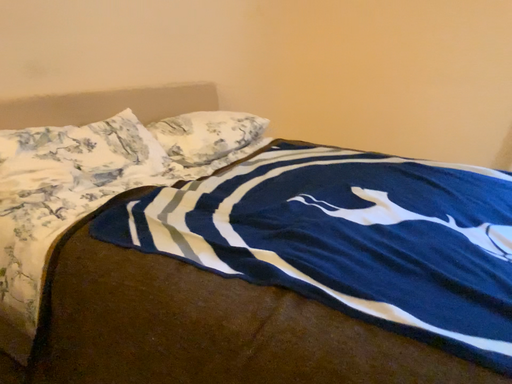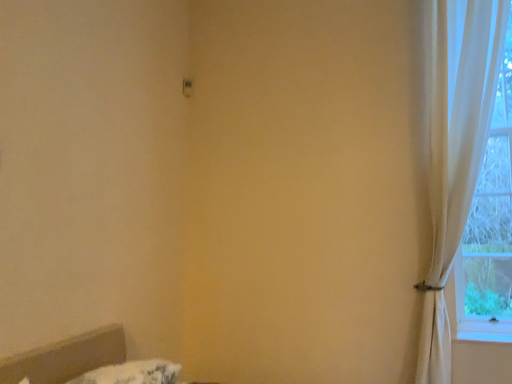
Question: Which way did the camera rotate in the video?

Choices:
 (A) rotated upward
 (B) rotated downward

Answer: (A)